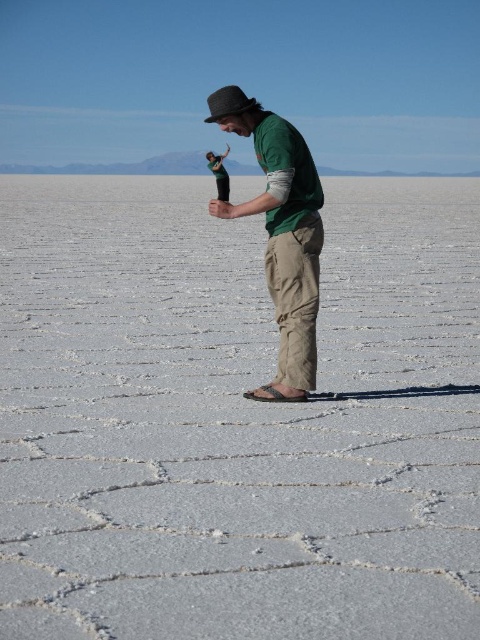
Can you confirm if matte black bottle at center is positioned to the right of green cotton shirt at center?

Incorrect, matte black bottle at center is not on the right side of green cotton shirt at center.

Can you confirm if matte black bottle at center is shorter than green cotton shirt at center?

Incorrect, matte black bottle at center's height does not fall short of green cotton shirt at center's.

Is point (287, 499) behind point (290, 358)?

No, it is in front of (290, 358).

This screenshot has height=640, width=480. I want to click on matte black bottle at center, so click(236, 419).